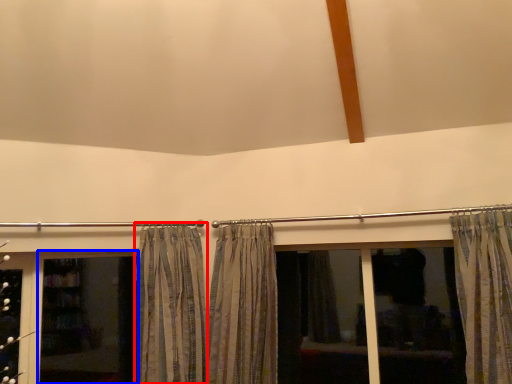
Question: Which point is further to the camera, curtain (highlighted by a red box) or screen door (highlighted by a blue box)?

Choices:
 (A) curtain
 (B) screen door

Answer: (B)